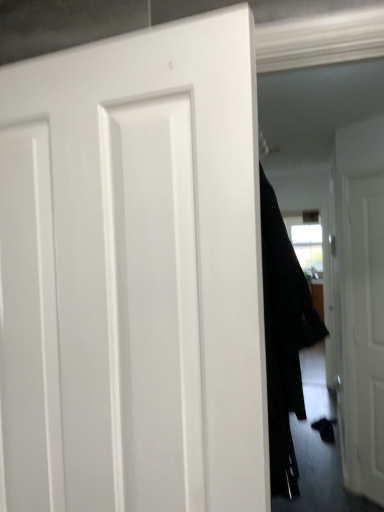
Question: Is white matte door at center, the first door from the left, smaller than white matte door at right, which is the 2th door from left to right?

Choices:
 (A) no
 (B) yes

Answer: (B)

Question: Is white matte door at center, the first door from the left, far away from white matte door at right, the 1th door in the right-to-left sequence?

Choices:
 (A) no
 (B) yes

Answer: (B)

Question: Does white matte door at center, the first door from the left, have a greater width compared to white matte door at right, the 1th door in the right-to-left sequence?

Choices:
 (A) no
 (B) yes

Answer: (A)

Question: Can you confirm if white matte door at center, the first door positioned from the front, is positioned to the right of white matte door at right, which is the 2th door from left to right?

Choices:
 (A) no
 (B) yes

Answer: (A)

Question: Can you confirm if white matte door at center, acting as the second door starting from the right, is thinner than white matte door at right, which is the 2th door from left to right?

Choices:
 (A) yes
 (B) no

Answer: (A)

Question: Is white matte door at center, the first door positioned from the front, turned away from white matte door at right, the 1th door in the right-to-left sequence?

Choices:
 (A) no
 (B) yes

Answer: (B)

Question: Does white matte door at center, marked as the 2th door in a back-to-front arrangement, contain black fabric coat at center?

Choices:
 (A) yes
 (B) no

Answer: (B)

Question: Is white matte door at center, acting as the second door starting from the right, at the left side of black fabric coat at center?

Choices:
 (A) yes
 (B) no

Answer: (A)

Question: From the image's perspective, is white matte door at center, marked as the 2th door in a back-to-front arrangement, under black fabric coat at center?

Choices:
 (A) yes
 (B) no

Answer: (B)

Question: From a real-world perspective, does white matte door at center, the first door from the left, sit lower than black fabric coat at center?

Choices:
 (A) yes
 (B) no

Answer: (B)

Question: Considering the relative sizes of white matte door at center, marked as the 2th door in a back-to-front arrangement, and black fabric coat at center in the image provided, is white matte door at center, marked as the 2th door in a back-to-front arrangement, shorter than black fabric coat at center?

Choices:
 (A) yes
 (B) no

Answer: (A)

Question: Is white matte door at center, the first door positioned from the front, thinner than black fabric coat at center?

Choices:
 (A) no
 (B) yes

Answer: (B)

Question: From a real-world perspective, is black fabric coat at center physically above white matte door at center, acting as the second door starting from the right?

Choices:
 (A) yes
 (B) no

Answer: (B)